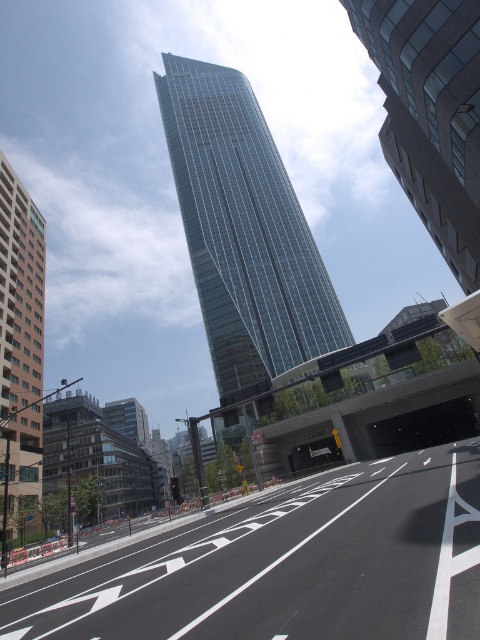
You are standing on the sidewalk and see both the glassy metallic skyscraper at center and the glassy reflective skyscraper at center. Which one is positioned more to the left?

The glassy metallic skyscraper at center is positioned more to the left than the glassy reflective skyscraper at center.

You are standing at the base of the modern skyscraper in the center of the image. You want to walk towards the point labeled point (x=451, y=42) and then to point (x=28, y=438). Which direction should you turn after reaching the first point to continue towards the second point?

After reaching point (x=451, y=42), you should turn right to continue towards point (x=28, y=438) since point (x=451, y=42) is in front of point (x=28, y=438).